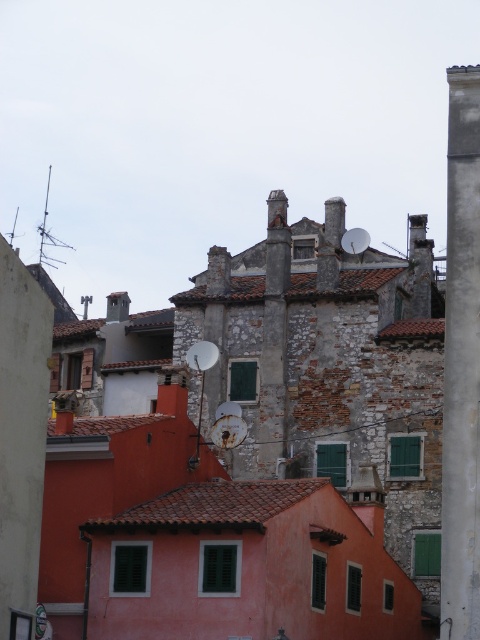
Who is positioned more to the right, smooth concrete pillar at right or metallic street sign at lower left?

smooth concrete pillar at right

Does point (443, 435) come behind point (39, 634)?

That is True.

The width and height of the screenshot is (480, 640). I want to click on smooth concrete pillar at right, so click(462, 364).